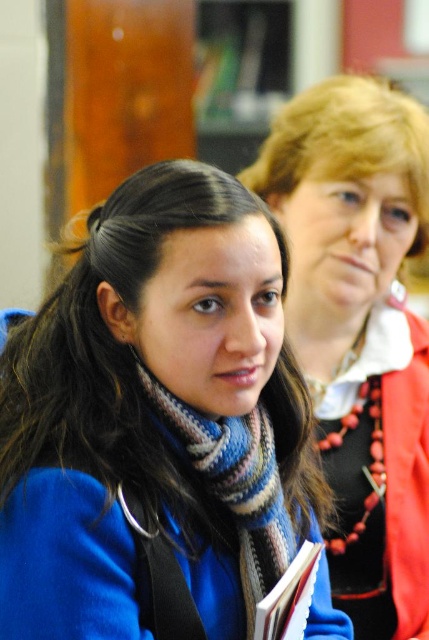
Is blue woolen scarf at center in front of matte black jacket at upper right?

Yes, blue woolen scarf at center is closer to the viewer.

Between blue woolen scarf at center and matte black jacket at upper right, which one has more height?

With more height is matte black jacket at upper right.

Is point (287, 269) more distant than point (395, 228)?

No, (287, 269) is closer to viewer.

The height and width of the screenshot is (640, 429). Find the location of `blue woolen scarf at center`. blue woolen scarf at center is located at coordinates (159, 426).

Is blue woolen scarf at center taller than knitted wool scarf at center?

Indeed, blue woolen scarf at center has a greater height compared to knitted wool scarf at center.

Which is more to the left, blue woolen scarf at center or knitted wool scarf at center?

Positioned to the left is blue woolen scarf at center.

Where is `blue woolen scarf at center`? The width and height of the screenshot is (429, 640). blue woolen scarf at center is located at coordinates (159, 426).

Is matte black jacket at upper right smaller than knitted wool scarf at center?

No, matte black jacket at upper right is not smaller than knitted wool scarf at center.

Does matte black jacket at upper right have a lesser height compared to knitted wool scarf at center?

Incorrect, matte black jacket at upper right's height does not fall short of knitted wool scarf at center's.

Is point (350, 406) farther from viewer compared to point (204, 442)?

Yes.

Find the location of a particular element. Image resolution: width=429 pixels, height=640 pixels. matte black jacket at upper right is located at coordinates (359, 330).